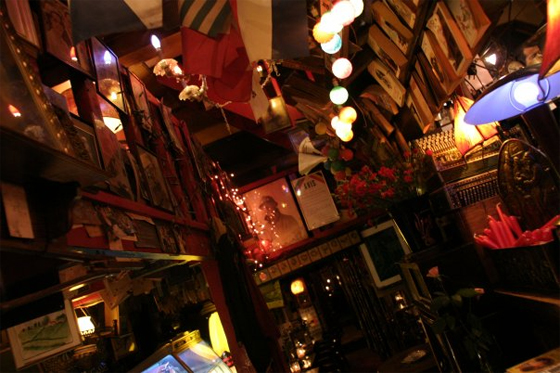
In order to click on purple lightbulb in this screenshot , I will do `click(536, 103)`.